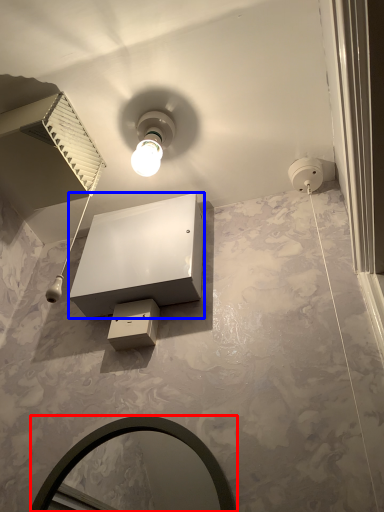
Question: Among these objects, which one is farthest to the camera, mirror (highlighted by a red box) or vanity (highlighted by a blue box)?

Choices:
 (A) mirror
 (B) vanity

Answer: (B)